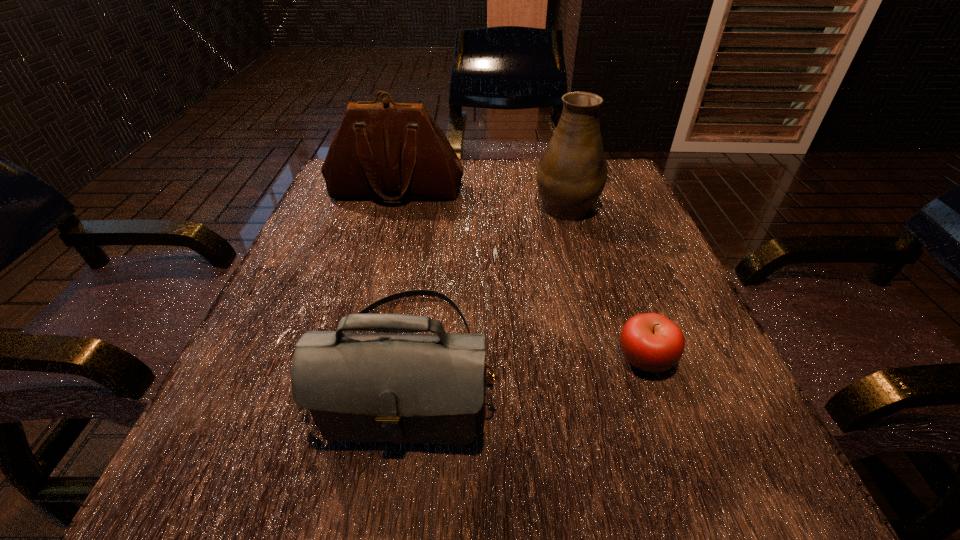
This screenshot has height=540, width=960. I want to click on free area in between the taller shoulder bag and the apple, so click(x=520, y=275).

Where is `blank region between the nearer shoulder bag and the taller shoulder bag`? blank region between the nearer shoulder bag and the taller shoulder bag is located at coordinates (401, 278).

At what (x,y) coordinates should I click in order to perform the action: click on vacant region between the apple and the third tallest object. Please return your answer as a coordinate pair (x, y). The image size is (960, 540). Looking at the image, I should click on (526, 362).

Find the location of a particular element. free spot between the apple and the taller shoulder bag is located at coordinates (520, 275).

Find the location of a particular element. The width and height of the screenshot is (960, 540). free space between the shortest object and the shorter shoulder bag is located at coordinates coord(526,362).

Choose which object is the nearest neighbor to the apple. Please provide its 2D coordinates. Your answer should be formatted as a tuple, i.e. [(x, y)], where the tuple contains the x and y coordinates of a point satisfying the conditions above.

[(359, 387)]

Choose which object is the nearest neighbor to the taller shoulder bag. Please provide its 2D coordinates. Your answer should be formatted as a tuple, i.e. [(x, y)], where the tuple contains the x and y coordinates of a point satisfying the conditions above.

[(571, 175)]

The height and width of the screenshot is (540, 960). I want to click on free spot that satisfies the following two spatial constraints: 1. on the front side of the apple; 2. on the left side of the farther shoulder bag, so click(348, 359).

You are a GUI agent. You are given a task and a screenshot of the screen. Output one action in this format:
    pyautogui.click(x=<x>, y=<y>)
    Task: Click on the free space that satisfies the following two spatial constraints: 1. on the back side of the apple; 2. on the right side of the nearer shoulder bag
    The image size is (960, 540).
    Given the screenshot: What is the action you would take?
    pyautogui.click(x=408, y=359)